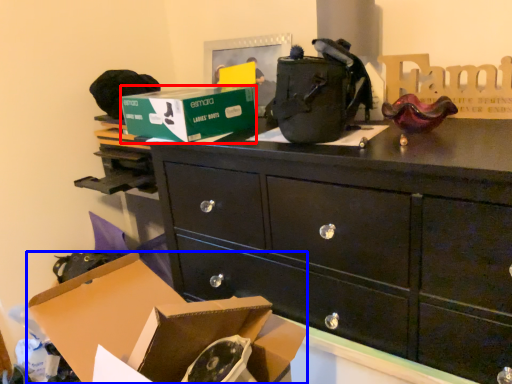
Question: Which object is closer to the camera taking this photo, box (highlighted by a red box) or box (highlighted by a blue box)?

Choices:
 (A) box
 (B) box

Answer: (B)